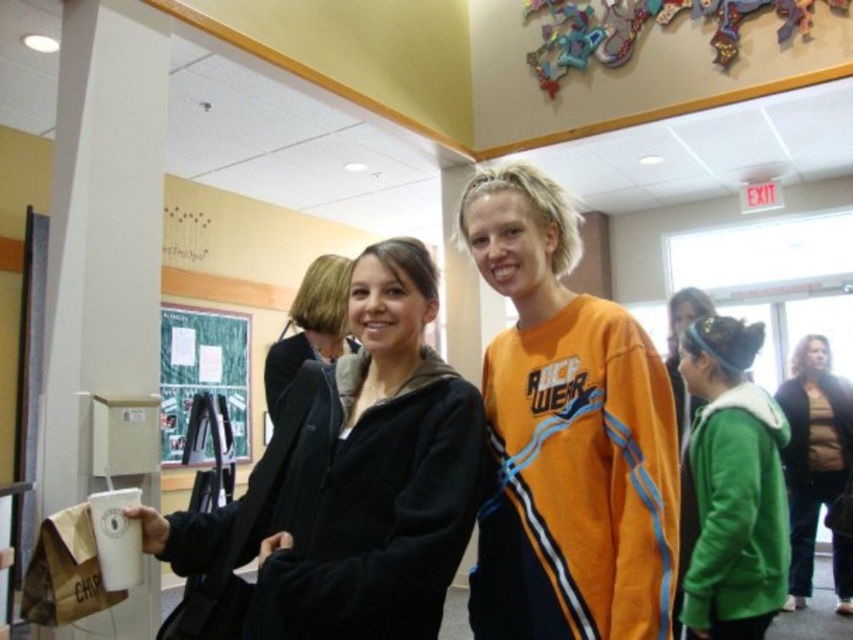
In the scene shown: Can you confirm if white matte pillar at left is bigger than green fuzzy coat at center?

Incorrect, white matte pillar at left is not larger than green fuzzy coat at center.

Find the location of a particular element. white matte pillar at left is located at coordinates (102, 230).

Is green fuzzy coat at center smaller than matte black jacket at center?

No, green fuzzy coat at center is not smaller than matte black jacket at center.

Between green fuzzy coat at center and matte black jacket at center, which one is positioned lower?

green fuzzy coat at center is lower down.

Identify the location of green fuzzy coat at center. (811, 452).

I want to click on green fuzzy coat at center, so click(x=811, y=452).

Who is taller, matte black hoodie at center or matte black jacket at center?

With more height is matte black hoodie at center.

Is matte black hoodie at center taller than matte black jacket at center?

Indeed, matte black hoodie at center has a greater height compared to matte black jacket at center.

Does point (277, 444) lie in front of point (306, 269)?

Yes, point (277, 444) is in front of point (306, 269).

The image size is (853, 640). In order to click on matte black hoodie at center in this screenshot , I will do pyautogui.click(x=372, y=474).